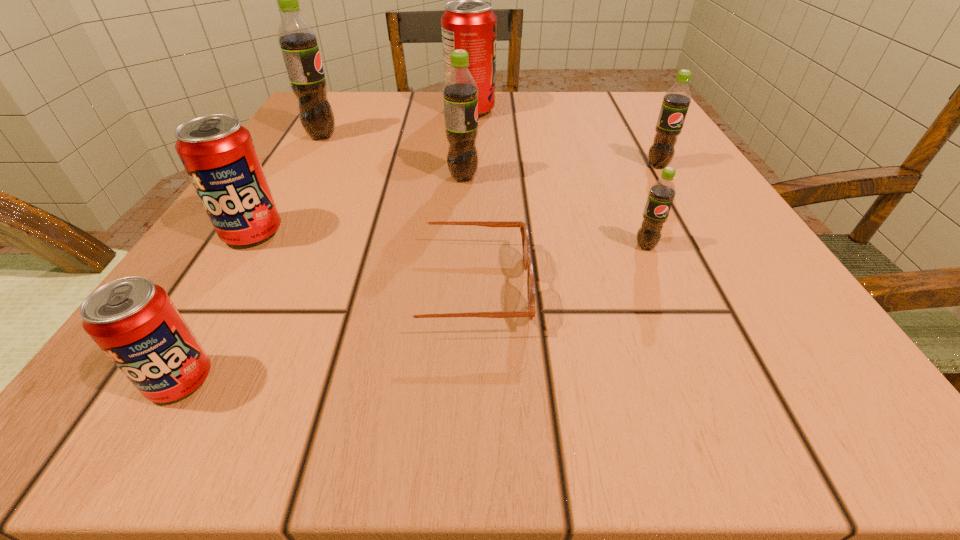
Identify the location of the nearest red soda can. (135, 323).

Where is `the nearest soda can`? This screenshot has width=960, height=540. the nearest soda can is located at coordinates (135, 323).

Image resolution: width=960 pixels, height=540 pixels. What are the coordinates of `the shortest object` in the screenshot? It's located at (527, 263).

This screenshot has height=540, width=960. Find the location of `sunglasses`. sunglasses is located at coordinates (527, 263).

Locate an element on the screen. vacant region located 0.130m on the front label of the second farthest soda can is located at coordinates (407, 136).

This screenshot has height=540, width=960. What are the coordinates of `vacant space located 0.240m on the right of the farthest soda can` in the screenshot? It's located at (609, 111).

Find the location of a particular element. This screenshot has height=540, width=960. vacant area situated 0.240m on the front label of the second biggest green soda is located at coordinates click(x=625, y=177).

Image resolution: width=960 pixels, height=540 pixels. Identify the location of free space located 0.350m on the front label of the rightmost soda can. (756, 332).

Locate an element on the screen. Image resolution: width=960 pixels, height=540 pixels. free point located 0.200m on the front of the second farthest red soda can is located at coordinates (162, 379).

In order to click on blank space located 0.110m on the front label of the smallest green soda in this screenshot , I will do `click(676, 315)`.